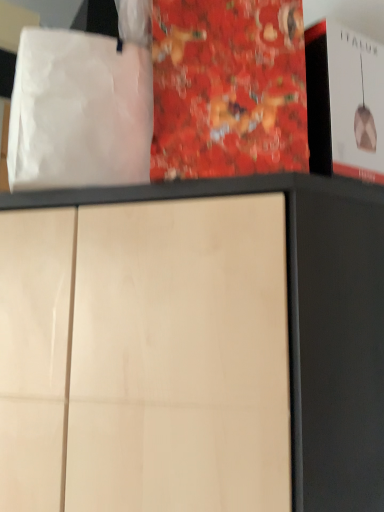
Question: In the image, is white paper bag at upper left positioned in front of or behind red glossy book at center?

Choices:
 (A) front
 (B) behind

Answer: (A)

Question: Considering the positions of point (119, 144) and point (162, 106), is point (119, 144) closer or farther from the camera than point (162, 106)?

Choices:
 (A) closer
 (B) farther

Answer: (B)

Question: In the image, is white paper bag at upper left on the left side or the right side of red glossy book at center?

Choices:
 (A) right
 (B) left

Answer: (B)

Question: Looking at the image, does red glossy book at center seem bigger or smaller compared to white paper bag at upper left?

Choices:
 (A) small
 (B) big

Answer: (B)

Question: Is point (177, 101) positioned closer to the camera than point (112, 42)?

Choices:
 (A) farther
 (B) closer

Answer: (B)

Question: In the image, is red glossy book at center on the left side or the right side of white paper bag at upper left?

Choices:
 (A) right
 (B) left

Answer: (A)

Question: In the image, is red glossy book at center positioned in front of or behind white paper bag at upper left?

Choices:
 (A) front
 (B) behind

Answer: (B)